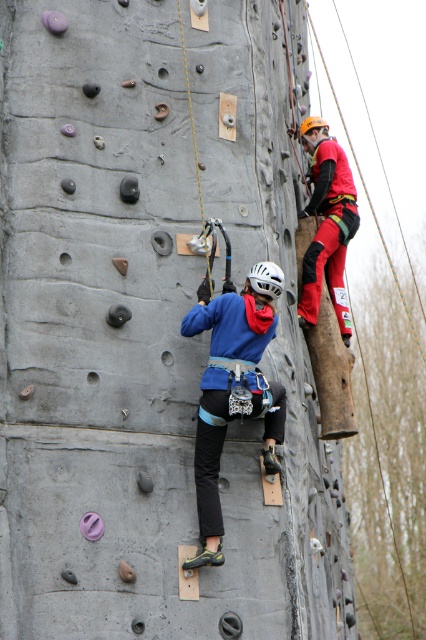
Question: Based on their relative distances, which object is nearer to the red matte climbing harness at upper right?

Choices:
 (A) white matte helmet at center
 (B) blue fabric climbing harness at center
 (C) orange matte helmet at upper center

Answer: (C)

Question: Which point is closer to the camera?

Choices:
 (A) (308, 124)
 (B) (313, 125)

Answer: (B)

Question: Is red matte climbing harness at upper right smaller than orange matte helmet at upper center?

Choices:
 (A) no
 (B) yes

Answer: (A)

Question: Is the position of red matte climbing harness at upper right less distant than that of orange matte helmet at upper center?

Choices:
 (A) yes
 (B) no

Answer: (A)

Question: Estimate the real-world distances between objects in this image. Which object is farther from the orange matte helmet at upper center?

Choices:
 (A) blue fabric climbing harness at center
 (B) red matte climbing harness at upper right
 (C) white matte helmet at center

Answer: (A)

Question: Does white matte helmet at center have a greater width compared to orange matte helmet at upper center?

Choices:
 (A) no
 (B) yes

Answer: (A)